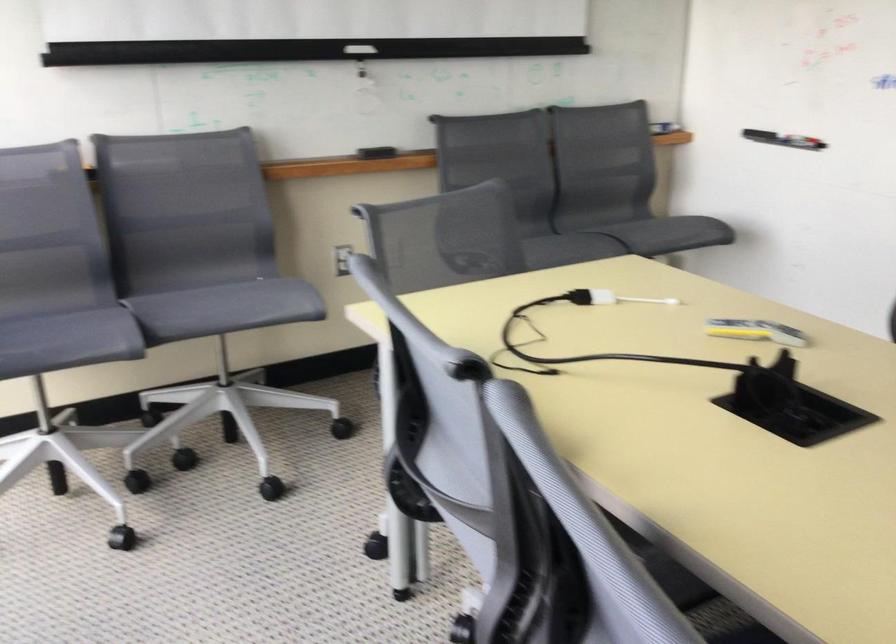
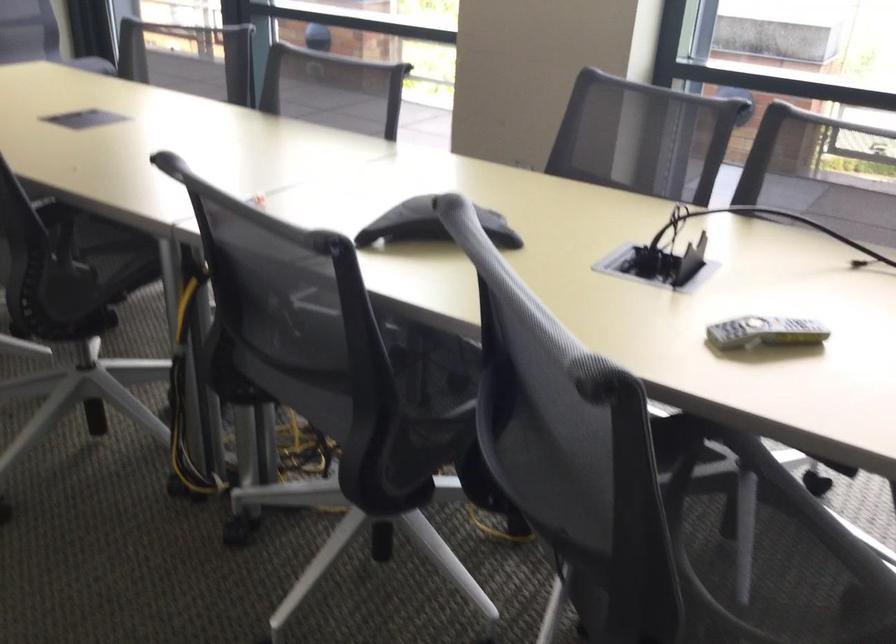
Find the pixel in the second image that matches pixel 737 330 in the first image.

(764, 332)